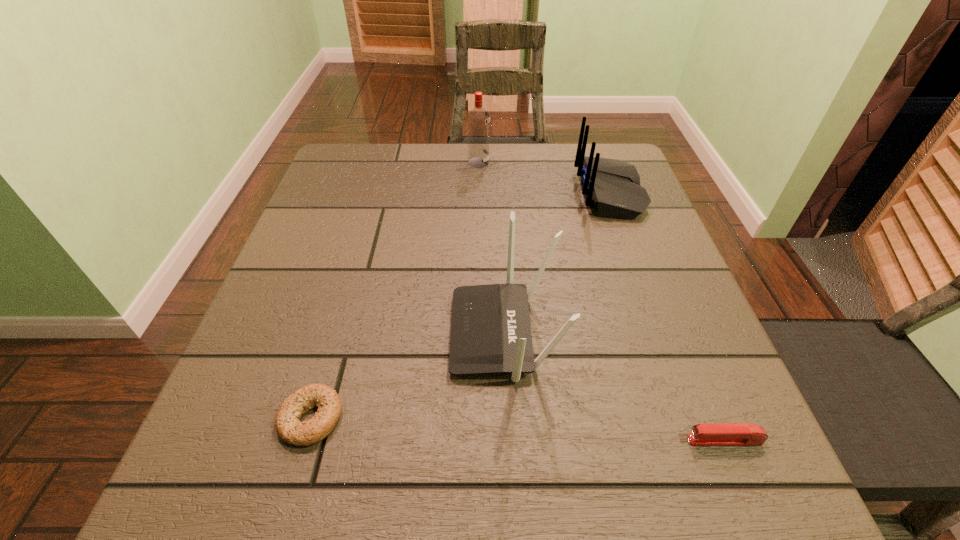
Where is `free space located 0.220m on the back of the farther router`? This screenshot has width=960, height=540. free space located 0.220m on the back of the farther router is located at coordinates (489, 193).

Identify the location of free space located 0.070m on the back of the farther router. The width and height of the screenshot is (960, 540). (550, 193).

The image size is (960, 540). What are the coordinates of `vacant region located 0.150m on the back of the farther router` in the screenshot? It's located at (517, 193).

I want to click on vacant space situated 0.170m on the front-facing side of the stapler, so click(571, 440).

Locate an element on the screen. The height and width of the screenshot is (540, 960). vacant area located 0.320m on the front-facing side of the stapler is located at coordinates pyautogui.click(x=468, y=440).

Identify the location of blank space located on the front-facing side of the stapler. (482, 440).

Find the location of a particular element. free space located 0.230m on the back of the leftmost object is located at coordinates (x=349, y=286).

Where is `vodka that is at the far edge`? vodka that is at the far edge is located at coordinates (478, 119).

Identify the location of router that is positioned at the far edge. (612, 186).

What are the coordinates of `object present at the left edge` in the screenshot? It's located at (289, 428).